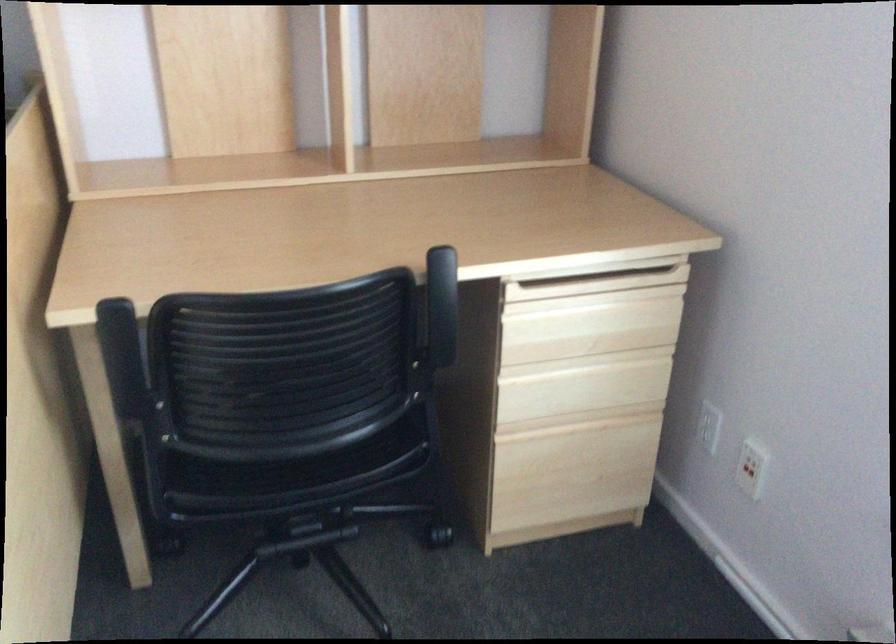
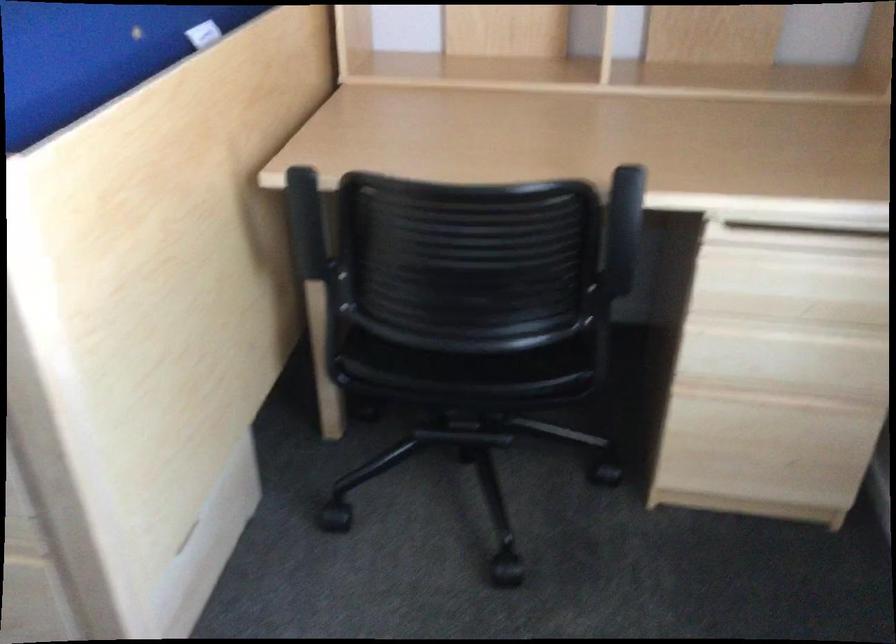
In the second image, find the point that corresponds to the point at 264,471 in the first image.

(433, 361)